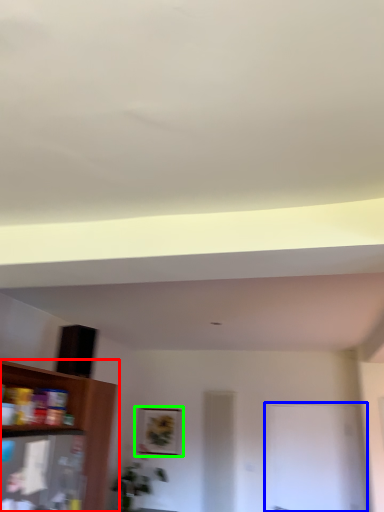
Question: Considering the real-world distances, which object is farthest from shelf (highlighted by a red box)? glass door (highlighted by a blue box) or picture frame (highlighted by a green box)?

Choices:
 (A) glass door
 (B) picture frame

Answer: (A)